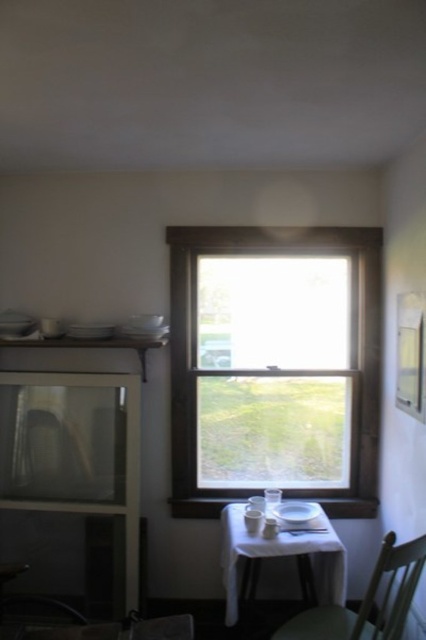
Measure the distance between brown wooden window at center and camera.

brown wooden window at center is 8.46 feet away from camera.

Who is taller, brown wooden window at center or green matte chair at lower right?

brown wooden window at center

Is point (215, 408) positioned behind point (296, 621)?

Yes.

The width and height of the screenshot is (426, 640). I want to click on brown wooden window at center, so click(275, 365).

Is brown wooden window at center below white matte table at center?

Actually, brown wooden window at center is above white matte table at center.

Is brown wooden window at center closer to the viewer compared to white matte table at center?

No, it is not.

Which is in front, point (219, 401) or point (230, 586)?

Point (230, 586)

Image resolution: width=426 pixels, height=640 pixels. In order to click on brown wooden window at center in this screenshot , I will do `click(275, 365)`.

Between point (314, 637) and point (238, 544), which one is positioned behind?

Point (238, 544)

Is green matte chair at lower right further to camera compared to white matte table at center?

No.

Locate an element on the screen. This screenshot has height=640, width=426. green matte chair at lower right is located at coordinates (367, 600).